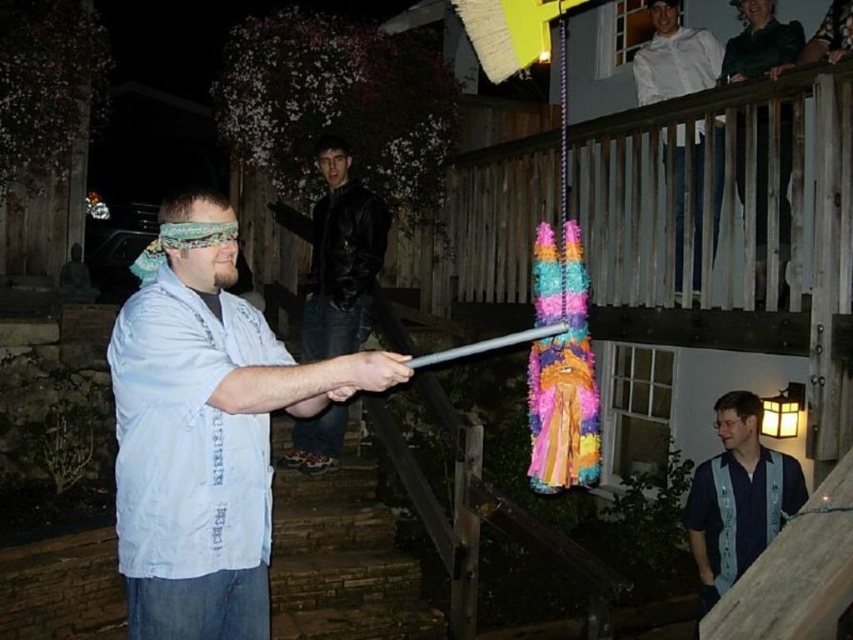
You are standing in the backyard and want to move closer to the point at location (207,628). Can you estimate how far you need to walk to reach that point?

The point at location (207,628) is 2.52 meters away from the viewer, so you need to walk approximately 2.52 meters to reach it.

You are standing at the origin point of the image. Where is the white cotton shirt at center located in terms of coordinates?

The white cotton shirt at center is located at coordinates point (206, 429).

You are standing in the backyard and see the blue striped shirt at center. If you want to throw a party favor to them, and the party favor can travel 3 meters, will it reach?

The blue striped shirt at center and viewer are 3.86 meters apart, so the party favor cannot reach them as it can only travel 3 meters.